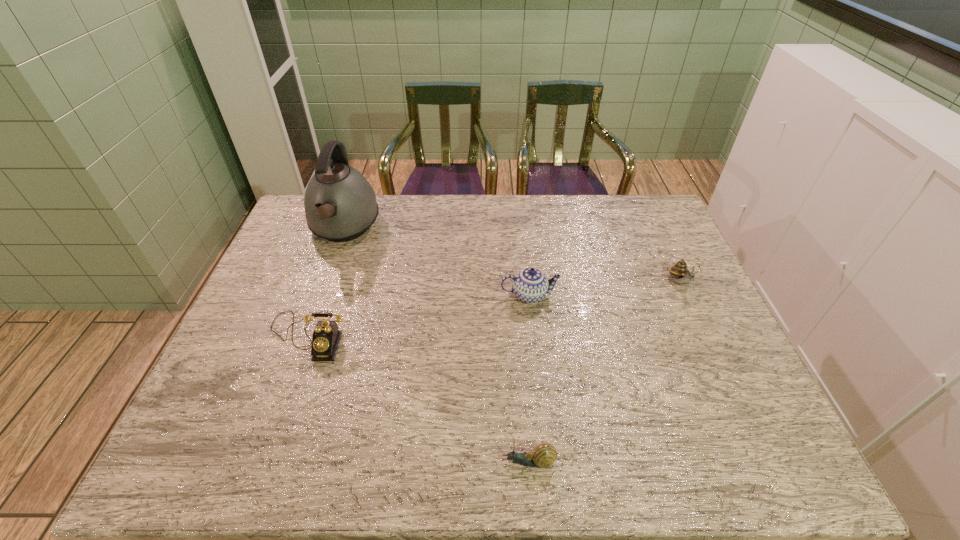
What are the coordinates of `the farthest object` in the screenshot? It's located at (340, 205).

At what (x,y) coordinates should I click in order to perform the action: click on kettle. Please return your answer as a coordinate pair (x, y). This screenshot has width=960, height=540. Looking at the image, I should click on (340, 205).

The image size is (960, 540). Identify the location of the taller escargot. (681, 274).

The image size is (960, 540). What are the coordinates of `the right escargot` in the screenshot? It's located at (681, 274).

Image resolution: width=960 pixels, height=540 pixels. Identify the location of chinaware. (530, 285).

Identify the location of telephone. The image size is (960, 540). (326, 337).

In order to click on the nearest object in this screenshot , I will do `click(544, 455)`.

Identify the location of the left escargot. (544, 455).

This screenshot has height=540, width=960. What are the coordinates of `free spot located 0.120m at the spout of the tallest object` in the screenshot? It's located at (323, 287).

The height and width of the screenshot is (540, 960). Find the location of `free region located on the face of the rightmost object`. free region located on the face of the rightmost object is located at coordinates (721, 371).